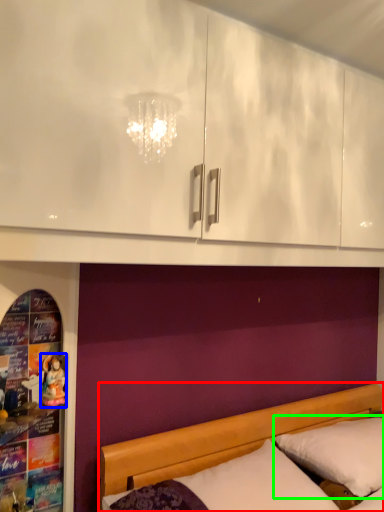
Question: Considering the real-world distances, which object is closest to bed (highlighted by a red box)? doll (highlighted by a blue box) or pillow (highlighted by a green box).

Choices:
 (A) doll
 (B) pillow

Answer: (B)